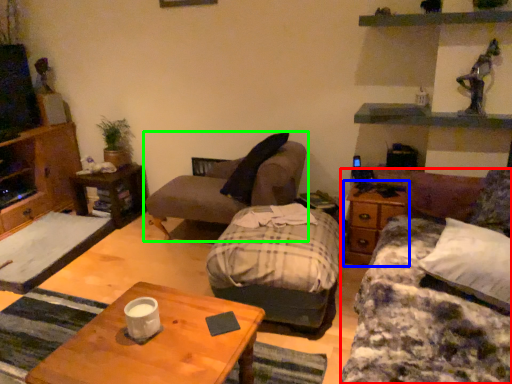
Question: Which object is positioned closest to studio couch (highlighted by a red box)? Select from side table (highlighted by a blue box) and chair (highlighted by a green box).

Choices:
 (A) side table
 (B) chair

Answer: (A)